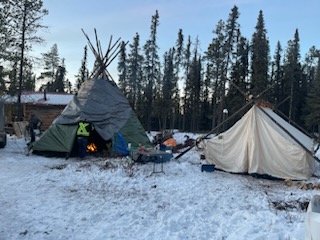
The width and height of the screenshot is (320, 240). What are the coordinates of `chair` in the screenshot? It's located at (159, 159).